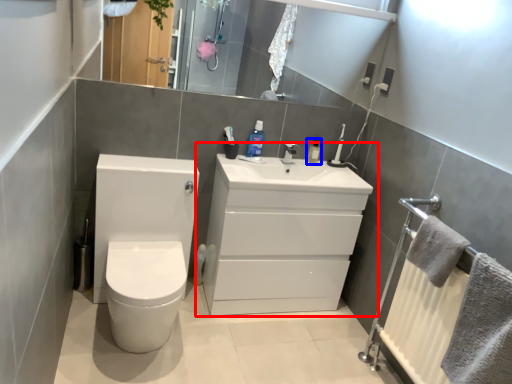
Question: Which of the following is the farthest to the observer, bathroom cabinet (highlighted by a red box) or mouthwash (highlighted by a blue box)?

Choices:
 (A) bathroom cabinet
 (B) mouthwash

Answer: (B)